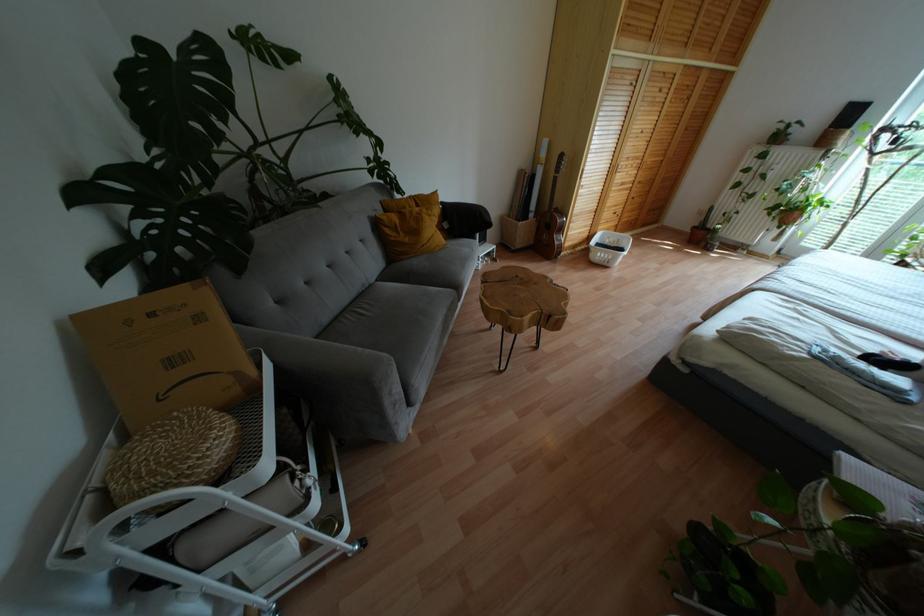
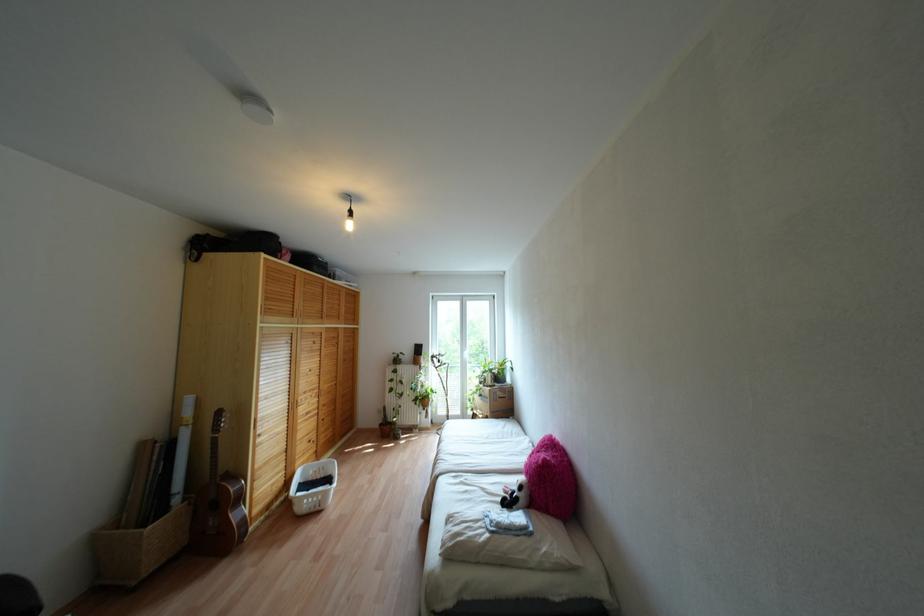
Find the pixel in the second image that matches point (821, 199) in the first image.

(431, 389)